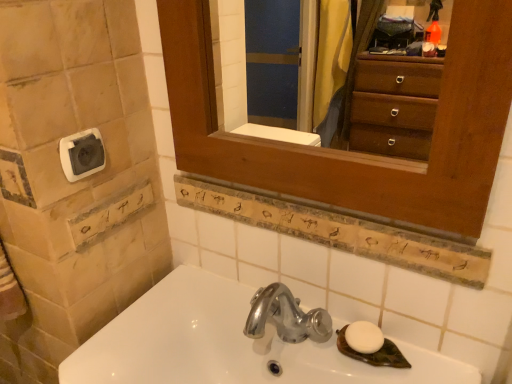
What is the approximate width of white plastic towel bar at upper left?

The width of white plastic towel bar at upper left is 0.77 inches.

Locate an element on the screen. The width and height of the screenshot is (512, 384). wooden medicine cabinet at upper center is located at coordinates (356, 153).

In the image, is wooden medicine cabinet at upper center on the left side or the right side of white matte soap at lower right?

Based on their positions, wooden medicine cabinet at upper center is located to the left of white matte soap at lower right.

This screenshot has width=512, height=384. I want to click on soap behind the wooden medicine cabinet at upper center, so click(x=364, y=337).

From the image's perspective, is wooden medicine cabinet at upper center positioned above or below white matte soap at lower right?

From the image's perspective, wooden medicine cabinet at upper center appears above white matte soap at lower right.

Which of these two, wooden medicine cabinet at upper center or white matte soap at lower right, stands shorter?

white matte soap at lower right.

Is wooden sign at center in contact with white plastic towel bar at upper left?

There is a gap between wooden sign at center and white plastic towel bar at upper left.

Is wooden sign at center oriented towards white plastic towel bar at upper left?

No, wooden sign at center is not aimed at white plastic towel bar at upper left.

Considering the sizes of objects wooden sign at center and white plastic towel bar at upper left in the image provided, who is thinner, wooden sign at center or white plastic towel bar at upper left?

With smaller width is wooden sign at center.

From a real-world perspective, which object rests below the other?

wooden sign at center, from a real-world perspective.

From a real-world perspective, is white plastic towel bar at upper left physically below wooden medicine cabinet at upper center?

Yes, from a real-world perspective, white plastic towel bar at upper left is beneath wooden medicine cabinet at upper center.

Looking at this image, in terms of size, does white plastic towel bar at upper left appear bigger or smaller than wooden medicine cabinet at upper center?

In the image, white plastic towel bar at upper left appears to be smaller than wooden medicine cabinet at upper center.

Which of these two, white plastic towel bar at upper left or wooden medicine cabinet at upper center, stands shorter?

With less height is white plastic towel bar at upper left.

Can you confirm if white plastic towel bar at upper left is thinner than wooden medicine cabinet at upper center?

Correct, the width of white plastic towel bar at upper left is less than that of wooden medicine cabinet at upper center.

Between point (133, 200) and point (384, 227), which one is positioned behind?

The point (133, 200) is farther from the camera.

Is white stone tiles at left wider or thinner than wooden sign at center?

Considering their sizes, white stone tiles at left looks broader than wooden sign at center.

Is white stone tiles at left facing towards wooden sign at center?

Yes, white stone tiles at left is oriented towards wooden sign at center.

Based on their positions, is white stone tiles at left located to the left or right of wooden sign at center?

Clearly, white stone tiles at left is on the left of wooden sign at center in the image.

Would you consider white stone tiles at left to be distant from wooden medicine cabinet at upper center?

No.

Considering the relative sizes of white stone tiles at left and wooden medicine cabinet at upper center in the image provided, is white stone tiles at left wider than wooden medicine cabinet at upper center?

No.

Is white stone tiles at left located outside wooden medicine cabinet at upper center?

Absolutely, white stone tiles at left is external to wooden medicine cabinet at upper center.

Which is in front, white stone tiles at left or wooden medicine cabinet at upper center?

wooden medicine cabinet at upper center is in front.

Is wooden medicine cabinet at upper center oriented towards white glossy sink at lower center?

No, wooden medicine cabinet at upper center does not turn towards white glossy sink at lower center.

Does point (187, 46) come behind point (249, 300)?

No, it is not.

Considering the positions of objects wooden medicine cabinet at upper center and white glossy sink at lower center in the image provided, who is in front, wooden medicine cabinet at upper center or white glossy sink at lower center?

white glossy sink at lower center.

Is white matte soap at lower right inside or outside of white glossy sink at lower center?

white matte soap at lower right is not enclosed by white glossy sink at lower center.

Is white matte soap at lower right far away from white glossy sink at lower center?

white matte soap at lower right is near white glossy sink at lower center, not far away.

From a real-world perspective, which is physically above, white matte soap at lower right or white glossy sink at lower center?

In real-world perspective, white matte soap at lower right is above.

Where is `medicine cabinet in front of the white matte soap at lower right`? medicine cabinet in front of the white matte soap at lower right is located at coordinates (356, 153).

At what (x,y) coordinates should I click in order to perform the action: click on towel bar on the left side of wooden sign at center. Please return your answer as a coordinate pair (x, y). This screenshot has width=512, height=384. Looking at the image, I should click on (82, 154).

Looking at the image, which one is located closer to white plastic towel bar at upper left, white stone tiles at left or white glossy sink at lower center?

white stone tiles at left is positioned closer to the anchor white plastic towel bar at upper left.

Based on their spatial positions, is white stone tiles at left or white plastic towel bar at upper left further from white matte soap at lower right?

white plastic towel bar at upper left lies further to white matte soap at lower right than the other object.

Looking at the image, which one is located further to white stone tiles at left, wooden sign at center or white glossy sink at lower center?

The object further to white stone tiles at left is wooden sign at center.

Considering their positions, is wooden medicine cabinet at upper center positioned closer to white stone tiles at left than white matte soap at lower right?

Among the two, wooden medicine cabinet at upper center is located nearer to white stone tiles at left.

Which object lies nearer to the anchor point white matte soap at lower right, wooden sign at center or white plastic towel bar at upper left?

The object closer to white matte soap at lower right is wooden sign at center.

Considering their positions, is white stone tiles at left positioned further to wooden medicine cabinet at upper center than wooden sign at center?

The object further to wooden medicine cabinet at upper center is white stone tiles at left.

Which object lies further to the anchor point white glossy sink at lower center, wooden medicine cabinet at upper center or white stone tiles at left?

wooden medicine cabinet at upper center is positioned further to the anchor white glossy sink at lower center.

Looking at the image, which one is located further to white stone tiles at left, wooden sign at center or white matte soap at lower right?

Among the two, white matte soap at lower right is located further to white stone tiles at left.

Where is `square situated between white plastic towel bar at upper left and wooden medicine cabinet at upper center from left to right`? square situated between white plastic towel bar at upper left and wooden medicine cabinet at upper center from left to right is located at coordinates (109, 214).

I want to click on ledge between wooden medicine cabinet at upper center and white matte soap at lower right from top to bottom, so click(340, 230).

The image size is (512, 384). Find the location of `ledge between white plastic towel bar at upper left and white glossy sink at lower center from top to bottom`. ledge between white plastic towel bar at upper left and white glossy sink at lower center from top to bottom is located at coordinates (340, 230).

The image size is (512, 384). In order to click on medicine cabinet situated between white plastic towel bar at upper left and white matte soap at lower right from left to right in this screenshot , I will do `click(356, 153)`.